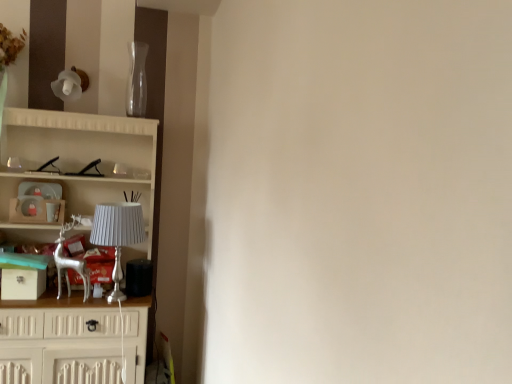
Question: Considering the relative sizes of silver metallic lamp at left and transparent glass vase at upper center in the image provided, is silver metallic lamp at left taller than transparent glass vase at upper center?

Choices:
 (A) yes
 (B) no

Answer: (A)

Question: Is silver metallic lamp at left to the left of transparent glass vase at upper center from the viewer's perspective?

Choices:
 (A) yes
 (B) no

Answer: (A)

Question: From a real-world perspective, is silver metallic lamp at left under transparent glass vase at upper center?

Choices:
 (A) yes
 (B) no

Answer: (A)

Question: Does silver metallic lamp at left have a smaller size compared to transparent glass vase at upper center?

Choices:
 (A) no
 (B) yes

Answer: (A)

Question: Is silver metallic lamp at left outside of transparent glass vase at upper center?

Choices:
 (A) yes
 (B) no

Answer: (A)

Question: From a real-world perspective, relative to white wooden cupboard at left, is silver metallic lamp at left vertically above or below?

Choices:
 (A) below
 (B) above

Answer: (B)

Question: Relative to white wooden cupboard at left, is silver metallic lamp at left in front or behind?

Choices:
 (A) behind
 (B) front

Answer: (A)

Question: From the image's perspective, relative to white wooden cupboard at left, is silver metallic lamp at left above or below?

Choices:
 (A) below
 (B) above

Answer: (B)

Question: Do you think silver metallic lamp at left is within white wooden cupboard at left, or outside of it?

Choices:
 (A) inside
 (B) outside

Answer: (A)

Question: From a real-world perspective, relative to silver metallic deer at left, is silver metallic lamp at left vertically above or below?

Choices:
 (A) below
 (B) above

Answer: (B)

Question: From the image's perspective, relative to silver metallic deer at left, is silver metallic lamp at left above or below?

Choices:
 (A) above
 (B) below

Answer: (A)

Question: Is point (119, 218) positioned closer to the camera than point (69, 266)?

Choices:
 (A) closer
 (B) farther

Answer: (A)

Question: Is silver metallic lamp at left spatially inside silver metallic deer at left, or outside of it?

Choices:
 (A) outside
 (B) inside

Answer: (A)

Question: Is silver metallic deer at left bigger or smaller than transparent glass vase at upper center?

Choices:
 (A) small
 (B) big

Answer: (B)

Question: From a real-world perspective, is silver metallic deer at left positioned above or below transparent glass vase at upper center?

Choices:
 (A) above
 (B) below

Answer: (B)